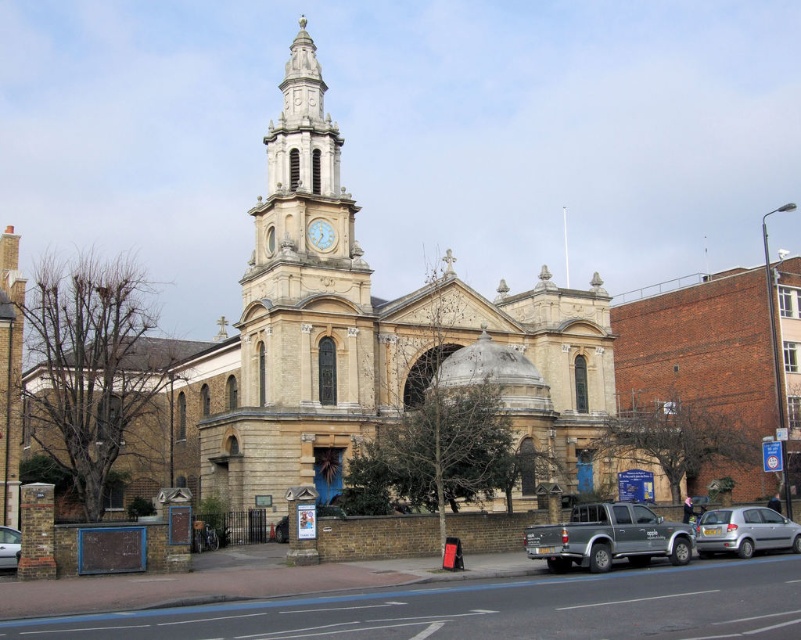
Question: Can you confirm if silver metallic hatchback at lower right is positioned to the left of white stone clock at center?

Choices:
 (A) no
 (B) yes

Answer: (A)

Question: Considering the real-world distances, which object is farthest from the matte gray pickup truck at lower center?

Choices:
 (A) white stone clock at center
 (B) silver metallic car at lower left
 (C) silver metallic hatchback at lower right

Answer: (B)

Question: Which object appears closest to the camera in this image?

Choices:
 (A) silver metallic car at lower left
 (B) matte gray pickup truck at lower center

Answer: (B)

Question: In this image, where is silver metallic hatchback at lower right located relative to silver metallic car at lower left?

Choices:
 (A) above
 (B) below

Answer: (B)

Question: Does silver metallic car at lower left appear over white stone clock at center?

Choices:
 (A) no
 (B) yes

Answer: (A)

Question: Estimate the real-world distances between objects in this image. Which object is closer to the silver metallic car at lower left?

Choices:
 (A) silver metallic hatchback at lower right
 (B) matte gray pickup truck at lower center
 (C) white stone clock at center

Answer: (C)